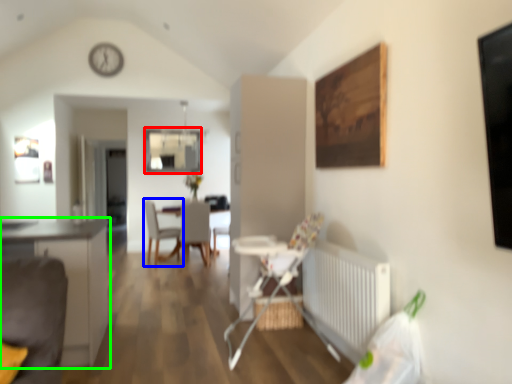
Question: Based on their relative distances, which object is farther from window (highlighted by a red box)? Choose from chair (highlighted by a blue box) and cabinetry (highlighted by a green box).

Choices:
 (A) chair
 (B) cabinetry

Answer: (B)